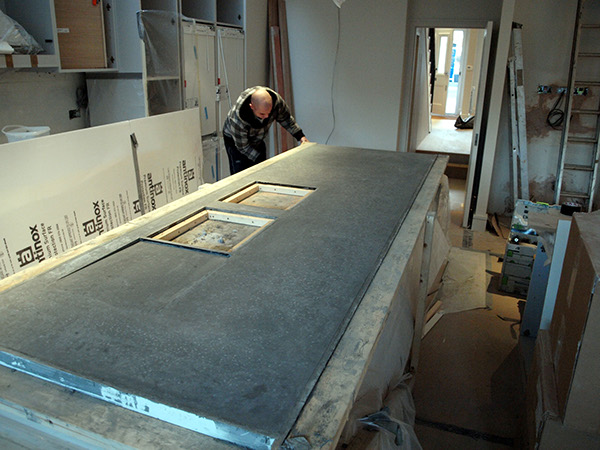
The image size is (600, 450). I want to click on bucket, so click(x=30, y=133).